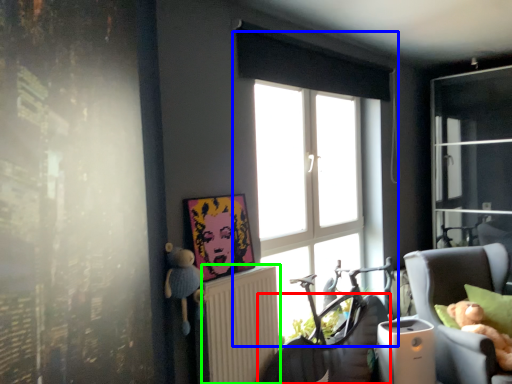
Question: Based on their relative distances, which object is nearer to swivel chair (highlighted by a red box)? Choose from window (highlighted by a blue box) and radiator (highlighted by a green box).

Choices:
 (A) window
 (B) radiator

Answer: (B)